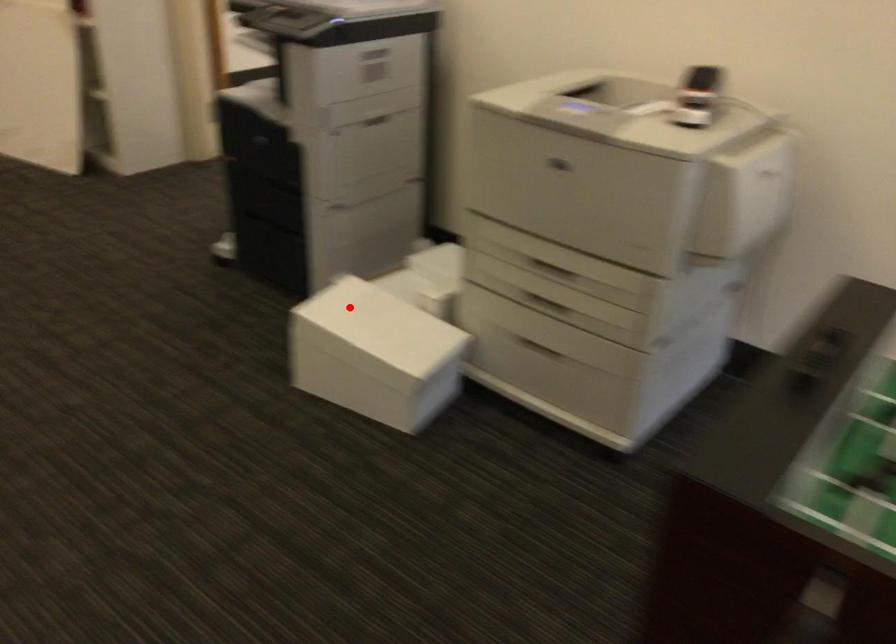
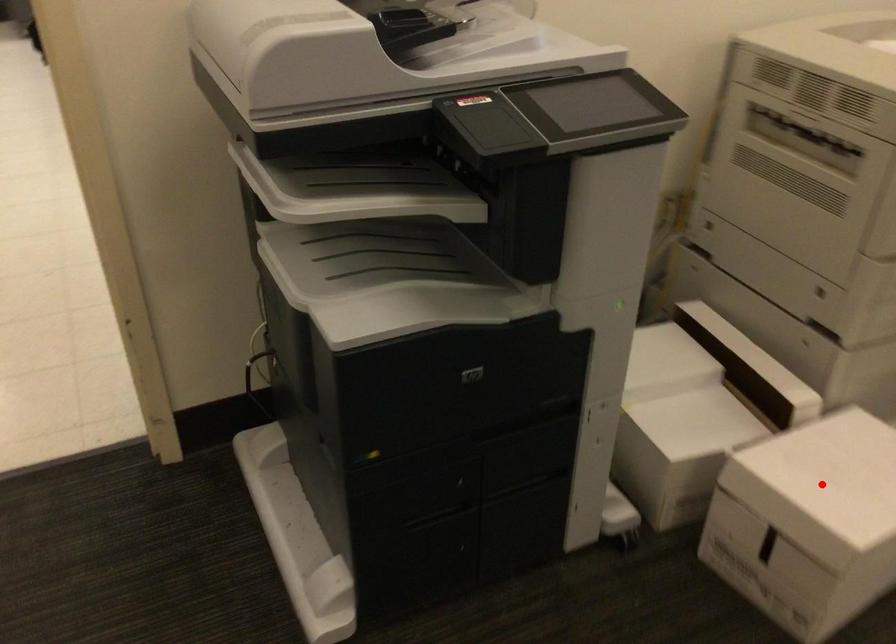
I am providing you with two images of the same scene from different viewpoints. A red point is marked on the first image and another point is marked on the second image. Is the red point in image1 aligned with the point shown in image2?

Yes